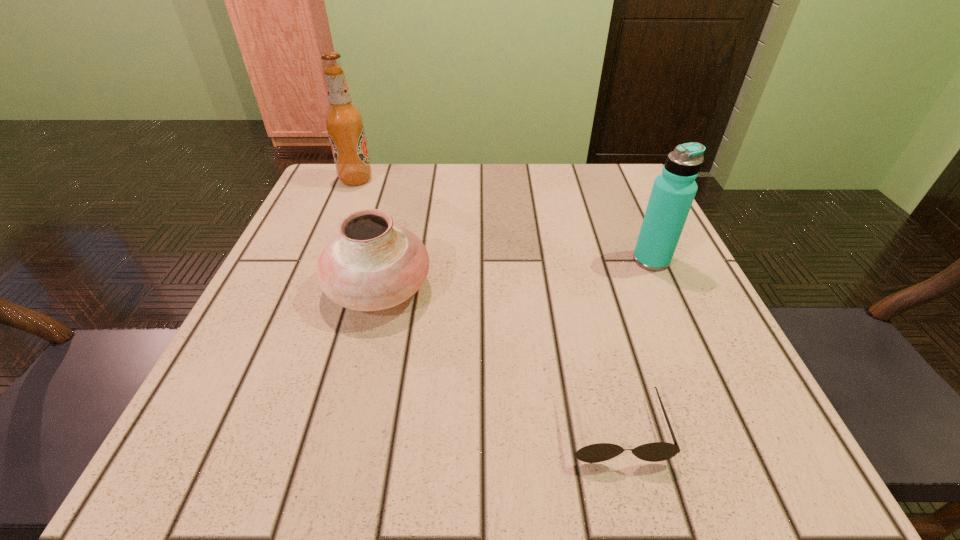
This screenshot has height=540, width=960. I want to click on object situated at the far edge, so click(x=344, y=122).

The image size is (960, 540). I want to click on object at the near edge, so click(x=657, y=451).

Find the location of a particular element. beer bottle positioned at the left edge is located at coordinates (344, 122).

This screenshot has width=960, height=540. I want to click on pottery present at the left edge, so click(373, 264).

This screenshot has width=960, height=540. Identify the location of water bottle present at the right edge. (673, 192).

The image size is (960, 540). In order to click on sunglasses present at the right edge in this screenshot , I will do `click(657, 451)`.

Where is `object present at the far left corner`? This screenshot has width=960, height=540. object present at the far left corner is located at coordinates click(x=344, y=122).

I want to click on object at the near right corner, so (657, 451).

In the image, there is a desktop. Where is `free space at the far edge`? free space at the far edge is located at coordinates (526, 172).

The image size is (960, 540). I want to click on vacant area at the left edge, so click(220, 390).